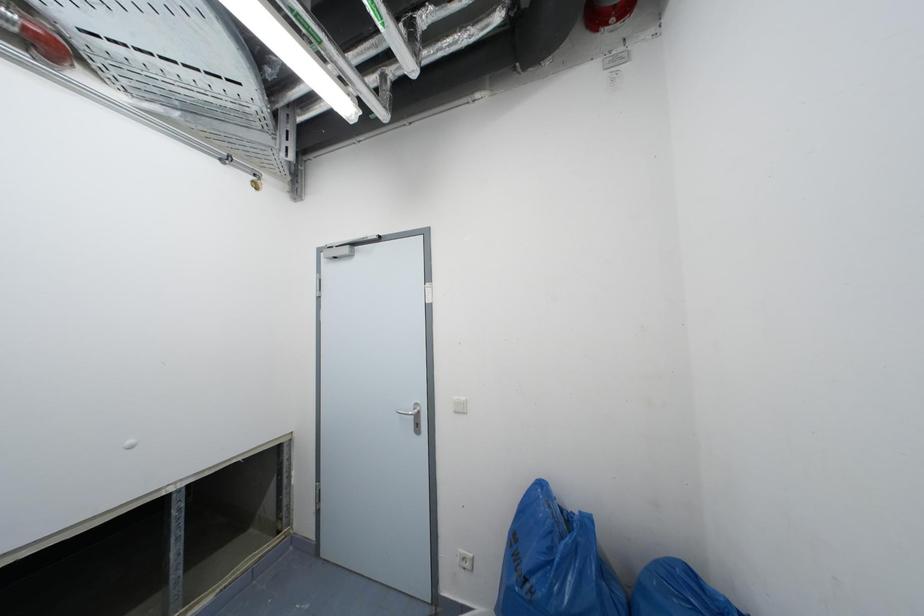
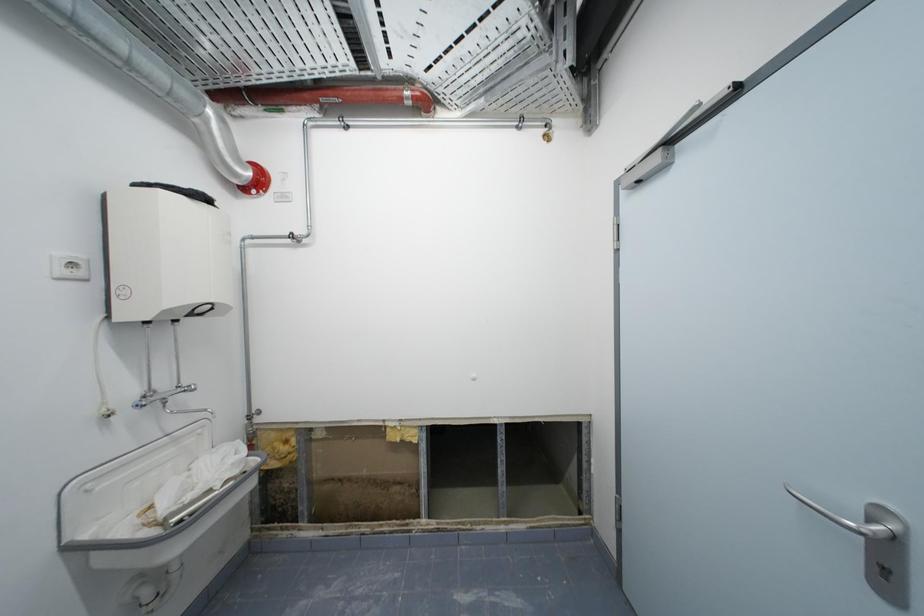
Question: The first image is from the beginning of the video and the second image is from the end. How did the camera likely rotate when shooting the video?

Choices:
 (A) Left
 (B) Right
 (C) Up
 (D) Down

Answer: (A)